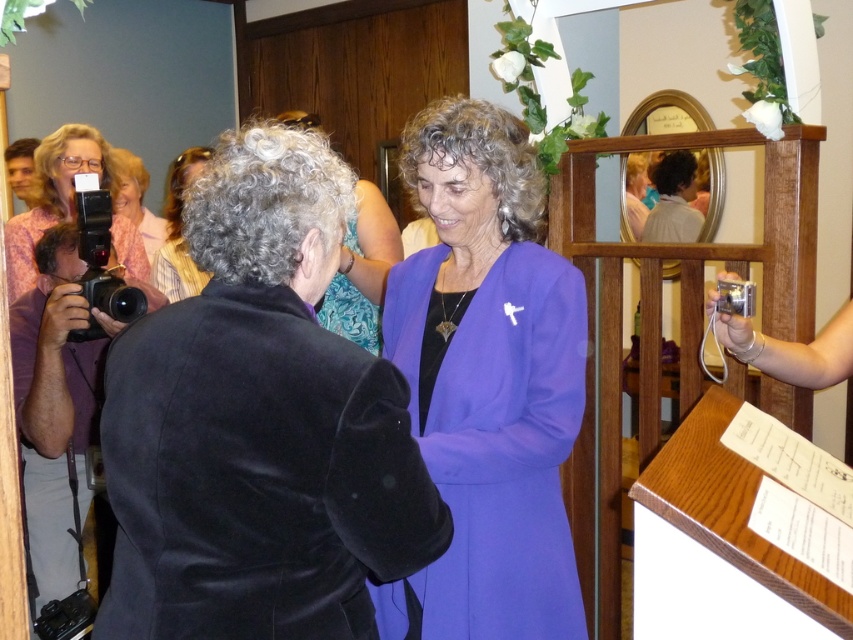
The image size is (853, 640). I want to click on purple fabric dress at center, so click(489, 376).

This screenshot has height=640, width=853. Describe the element at coordinates (489, 376) in the screenshot. I see `purple fabric dress at center` at that location.

Where is `purple fabric dress at center`? This screenshot has height=640, width=853. purple fabric dress at center is located at coordinates (489, 376).

Can you confirm if purple velvet jacket at center is shorter than matte pink blouse at upper left?

Yes, purple velvet jacket at center is shorter than matte pink blouse at upper left.

In the scene shown: Which is above, purple velvet jacket at center or matte pink blouse at upper left?

matte pink blouse at upper left is higher up.

This screenshot has height=640, width=853. Find the location of `purple velvet jacket at center`. purple velvet jacket at center is located at coordinates (363, 272).

Does purple fabric dress at center appear under curly hair at center?

Yes, purple fabric dress at center is below curly hair at center.

Does purple fabric dress at center have a larger size compared to curly hair at center?

Correct, purple fabric dress at center is larger in size than curly hair at center.

Is point (519, 360) farther from viewer compared to point (198, 278)?

No, it is in front of (198, 278).

The width and height of the screenshot is (853, 640). I want to click on purple fabric dress at center, so click(x=489, y=376).